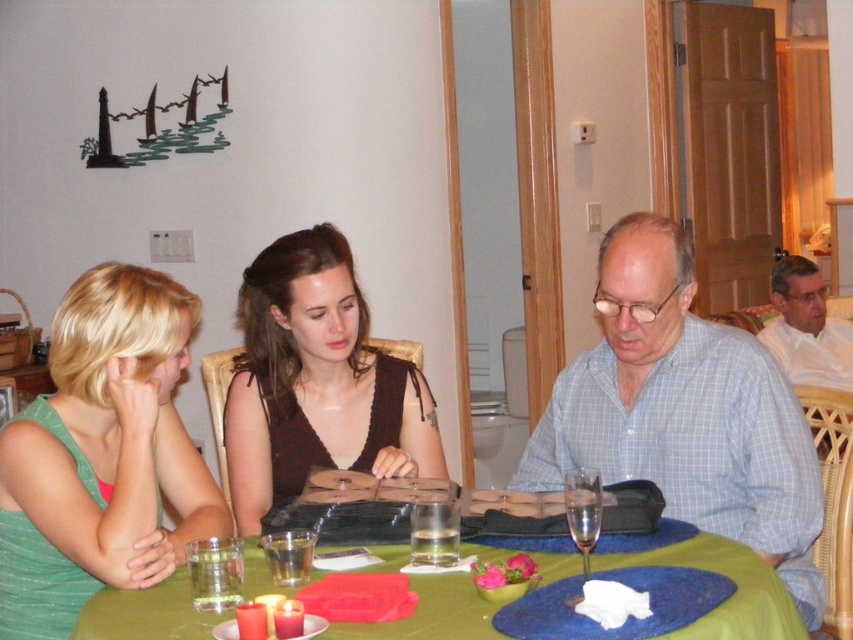
Question: Where is light blue checkered shirt at center located in relation to matte brown dress at center in the image?

Choices:
 (A) below
 (B) above

Answer: (A)

Question: In this image, where is light blue checkered shirt at center located relative to green fabric table at center?

Choices:
 (A) below
 (B) above

Answer: (B)

Question: Which object is positioned farthest from the light blue checkered shirt at center?

Choices:
 (A) clear glass wine glass at center
 (B) matte brown dress at center

Answer: (B)

Question: Which point is closer to the camera?

Choices:
 (A) (589, 522)
 (B) (669, 317)

Answer: (A)

Question: Is green fabric dress at lower left behind matte brown dress at center?

Choices:
 (A) no
 (B) yes

Answer: (A)

Question: Based on their relative distances, which object is farther from the matte brown dress at center?

Choices:
 (A) clear glass wine glass at center
 (B) light blue checkered shirt at center
 (C) green fabric table at center

Answer: (A)